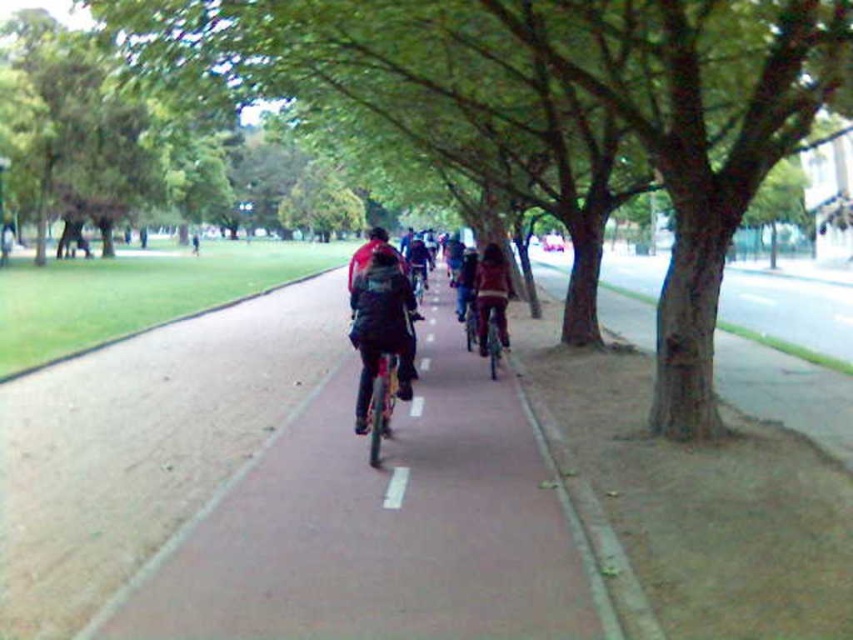
You are a cyclist on the pathway and want to reach the point at coordinates point (x=399, y=467). If you are currently at point (x=492, y=257), which direction should you head to move towards your destination?

Since point (x=492, y=257) is behind point (x=399, y=467), you should move forward along the pathway towards the destination point (x=399, y=467).

You are a cyclist on the pathway and notice a dark blue jacket at center and a white matte line at center. Which object is closer to the left side of the pathway?

The dark blue jacket at center is closer to the left side of the pathway because it is to the left of the white matte line at center.